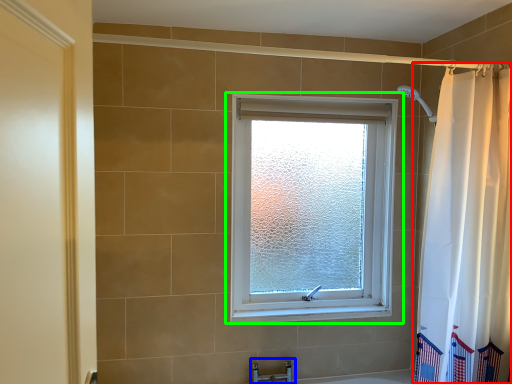
Question: Which object is positioned closest to curtain (highlighted by a red box)? Select from faucet (highlighted by a blue box) and window (highlighted by a green box).

Choices:
 (A) faucet
 (B) window

Answer: (B)